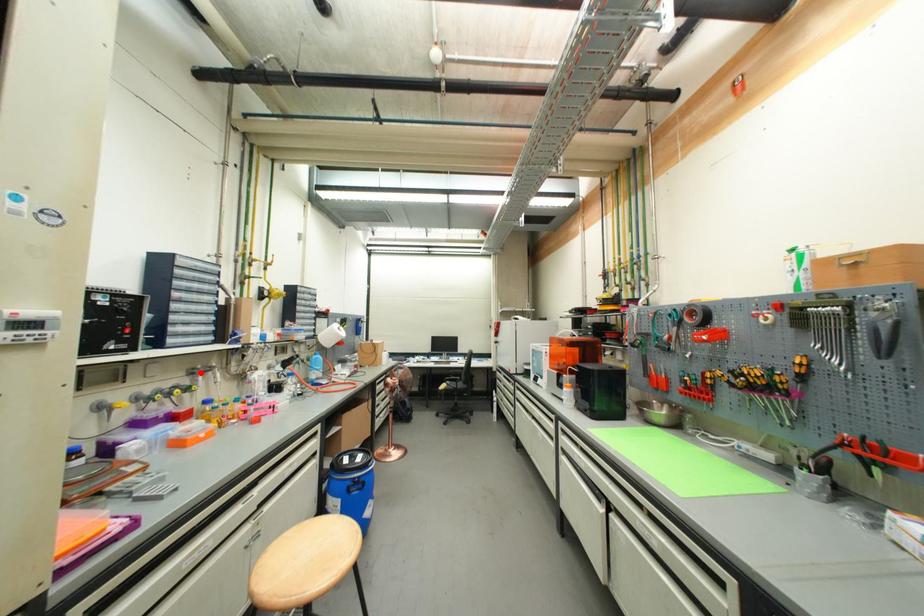
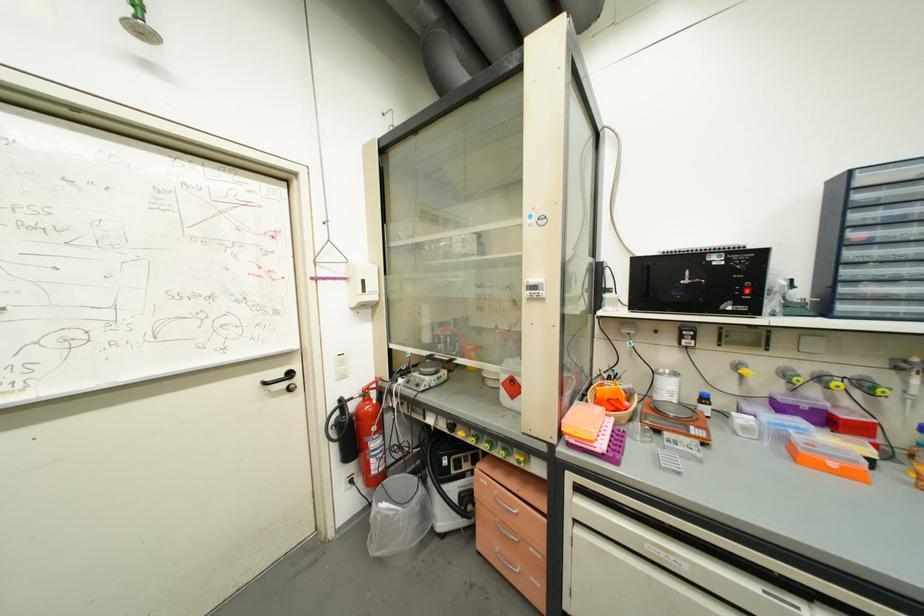
In the second image, find the point that corresponds to the highlighted location in the first image.

(909, 367)